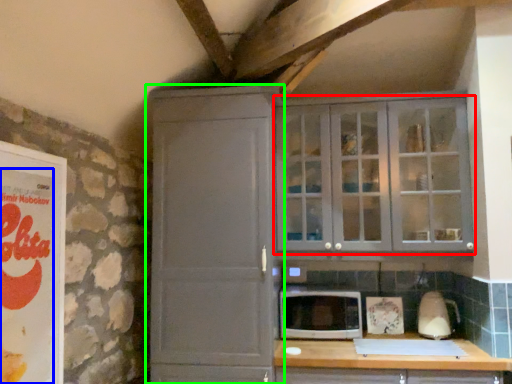
Question: Estimate the real-world distances between objects in this image. Which object is farther from cupboard (highlighted by a red box), advertisement (highlighted by a blue box) or cupboard (highlighted by a green box)?

Choices:
 (A) advertisement
 (B) cupboard

Answer: (A)